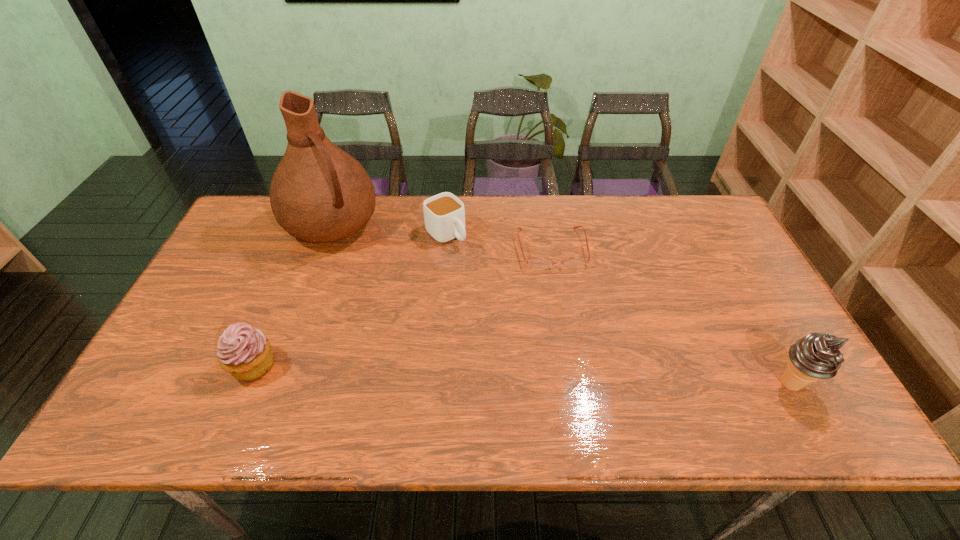
At what (x,y) coordinates should I click in order to perform the action: click on vacant space that's between the third tallest object and the tallest object. Please return your answer as a coordinate pair (x, y). Image resolution: width=960 pixels, height=540 pixels. Looking at the image, I should click on (293, 295).

Point out which object is positioned as the fourth nearest to the tallest object. Please provide its 2D coordinates. Your answer should be formatted as a tuple, i.e. [(x, y)], where the tuple contains the x and y coordinates of a point satisfying the conditions above.

[(816, 356)]

Locate which object ranks in proximity to the fourth tallest object. Please provide its 2D coordinates. Your answer should be formatted as a tuple, i.e. [(x, y)], where the tuple contains the x and y coordinates of a point satisfying the conditions above.

[(319, 193)]

Locate an element on the screen. free spot that satisfies the following two spatial constraints: 1. on the front side of the third shortest object; 2. on the left side of the icecream is located at coordinates (245, 384).

Image resolution: width=960 pixels, height=540 pixels. I want to click on vacant space that satisfies the following two spatial constraints: 1. on the front side of the rightmost object; 2. on the left side of the shortest object, so click(x=574, y=384).

This screenshot has width=960, height=540. In order to click on free space that satisfies the following two spatial constraints: 1. on the front side of the pitcher; 2. on the left side of the cup in this screenshot , I will do `click(328, 234)`.

The width and height of the screenshot is (960, 540). Identify the location of vacant space that satisfies the following two spatial constraints: 1. on the back side of the third tallest object; 2. on the right side of the third object from left to right. (307, 234).

I want to click on vacant area that satisfies the following two spatial constraints: 1. on the front side of the fourth object from left to right; 2. on the left side of the third object from left to right, so click(444, 248).

This screenshot has width=960, height=540. What are the coordinates of `vacant space that satisfies the following two spatial constraints: 1. on the back side of the shortest object; 2. on the right side of the third shortest object` in the screenshot? It's located at (301, 248).